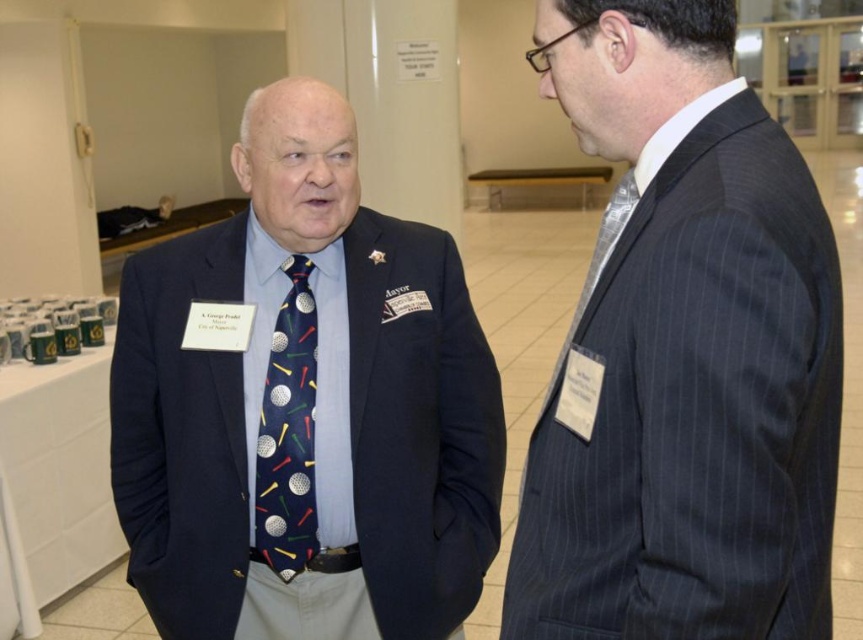
Which is below, dark pinstripe suit at right or navy blue suit at center?

Positioned lower is navy blue suit at center.

Is point (778, 515) farther from camera compared to point (386, 460)?

That is False.

At what (x,y) coordinates should I click in order to perform the action: click on dark pinstripe suit at right. Please return your answer as a coordinate pair (x, y). Looking at the image, I should click on (682, 353).

Is dark pinstripe suit at right taller than silvery metallic tie at right?

Indeed, dark pinstripe suit at right has a greater height compared to silvery metallic tie at right.

Is dark pinstripe suit at right wider than silvery metallic tie at right?

Yes.

This screenshot has width=863, height=640. I want to click on dark pinstripe suit at right, so [682, 353].

Identify the location of dark pinstripe suit at right. The image size is (863, 640). (682, 353).

Is point (288, 480) farther from viewer compared to point (587, 284)?

Yes, it is.

Who is shorter, navy fabric tie at center or silvery metallic tie at right?

Standing shorter between the two is silvery metallic tie at right.

Does point (276, 339) lie behind point (576, 307)?

That is True.

Identify the location of navy fabric tie at center. (288, 433).